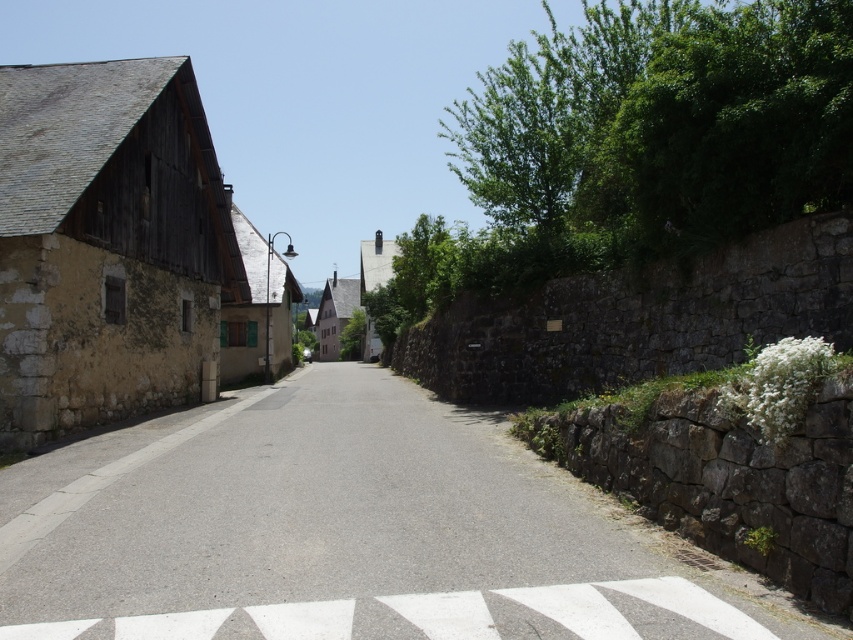
You are a delivery driver trying to park your van on the road. The van is 2 meters wide. The white textured road marking at center and the metallic street sign at center are on the road. Which object on the road has a narrower width, allowing your van to park without hitting it?

The white textured road marking at center has a lesser width compared to the metallic street sign at center, so the van can park without hitting the white textured road marking at center since it is narrower.